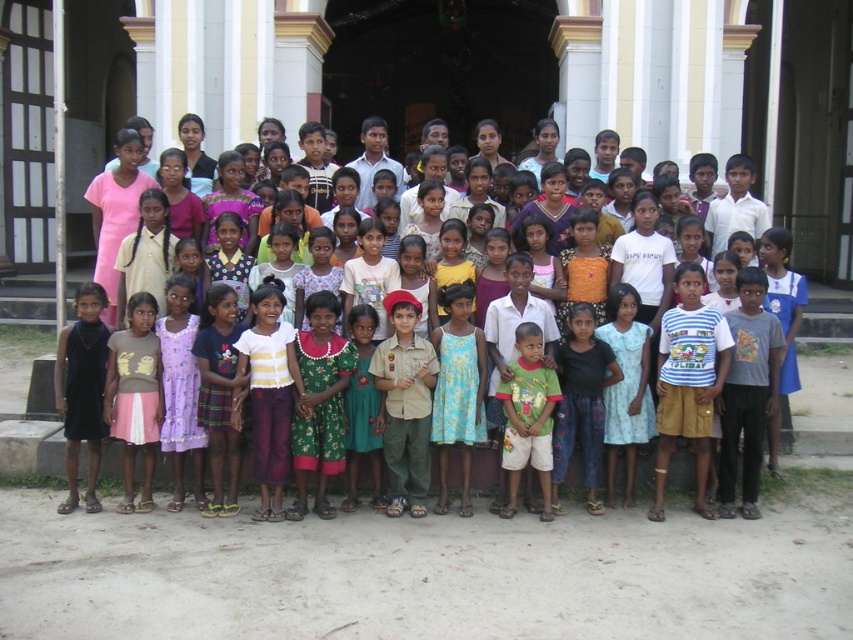
Based on the photo, you are a photographer trying to capture both the green dress at center and the green cotton shirt at center in a single frame. Based on their sizes, which one would appear bigger in the photo?

The green dress at center would appear bigger in the photo because it has a larger size compared to the green cotton shirt at center.

You are standing in front of the classical building and notice two points marked in the image. Which point is closer to you, point (775,412) or point (541,516)?

Point (775,412) is further to the viewer than point (541,516), so point (541,516) is closer to you.

You are a photographer trying to capture a clear photo of the green dress at center and the green cotton shirt at center. Since you want both subjects in focus, which one should you adjust your camera lens to prioritize focusing on first?

The green cotton shirt at center is behind the green dress at center, so you should prioritize focusing on the green cotton shirt at center first to ensure both are in focus.